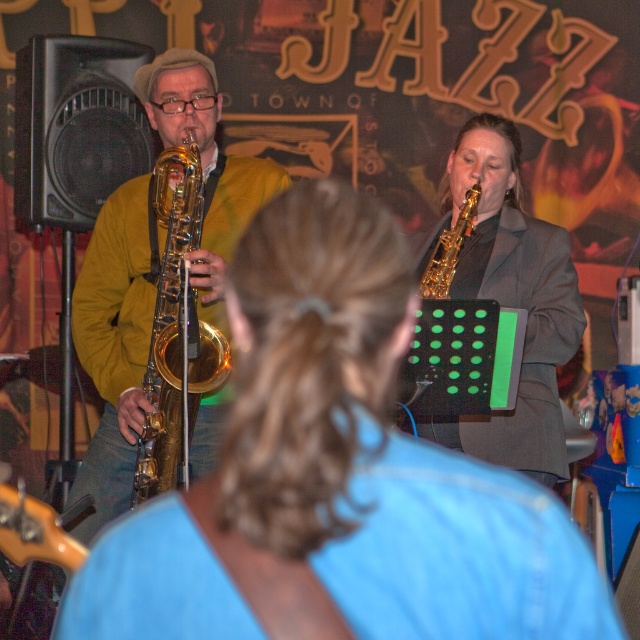
You are a photographer trying to capture both the shiny gold saxophone at upper center and the gold shiny trumpet at left in a single frame. Based on their positions and sizes, which instrument should you adjust your camera angle to prioritize to ensure both fit in the frame?

The shiny gold saxophone at upper center might be wider than the gold shiny trumpet at left, so you should prioritize adjusting your camera angle to accommodate the width of the shiny gold saxophone at upper center first.

You are a photographer in the audience at this jazz performance. You want to take a photo that includes both the gold shiny trumpet at left and the gold shiny trumpet at right. Which trumpet should you position closer to the center of the frame to ensure both are fully visible?

The gold shiny trumpet at left is much taller than the gold shiny trumpet at right. To ensure both are fully visible in the photo, position the taller gold shiny trumpet at left closer to the center of the frame so it doesn not get cut off.